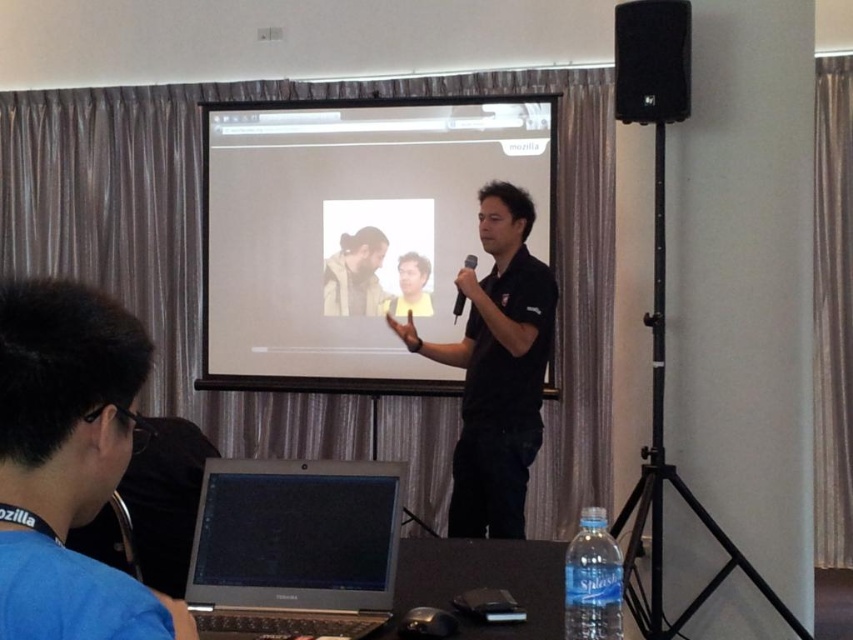
Which is behind, point (378, 316) or point (463, 298)?

The point (378, 316) is behind.

You are a GUI agent. You are given a task and a screenshot of the screen. Output one action in this format:
    pyautogui.click(x=<x>, y=<y>)
    Task: Click on the matte white projector screen at center
    
    Given the screenshot: What is the action you would take?
    pyautogui.click(x=350, y=228)

Which is above, black matte speaker at upper right or brown suede jacket at center?

black matte speaker at upper right is above.

Which is more to the right, black matte speaker at upper right or brown suede jacket at center?

black matte speaker at upper right

Does point (663, 48) come closer to viewer compared to point (341, 291)?

Yes, point (663, 48) is closer to viewer.

Locate an element on the screen. The width and height of the screenshot is (853, 640). black matte speaker at upper right is located at coordinates (653, 60).

The image size is (853, 640). What do you see at coordinates (350, 228) in the screenshot?
I see `matte white projector screen at center` at bounding box center [350, 228].

Is matte white projector screen at center bigger than brown suede jacket at center?

Yes, matte white projector screen at center is bigger than brown suede jacket at center.

Describe the element at coordinates (350, 228) in the screenshot. I see `matte white projector screen at center` at that location.

Where is `matte white projector screen at center`? matte white projector screen at center is located at coordinates (350, 228).